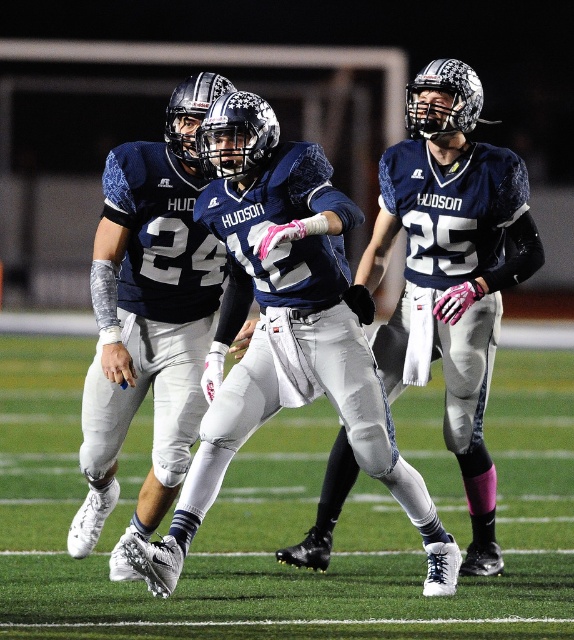
What do you see at coordinates (280, 522) in the screenshot?
I see `green turf at center` at bounding box center [280, 522].

Between point (389, 512) and point (373, 404), which one is positioned in front?

Point (373, 404) is more forward.

You are a GUI agent. You are given a task and a screenshot of the screen. Output one action in this format:
    pyautogui.click(x=<x>, y=<y>)
    Task: Click on the green turf at center
    
    Given the screenshot: What is the action you would take?
    pyautogui.click(x=280, y=522)